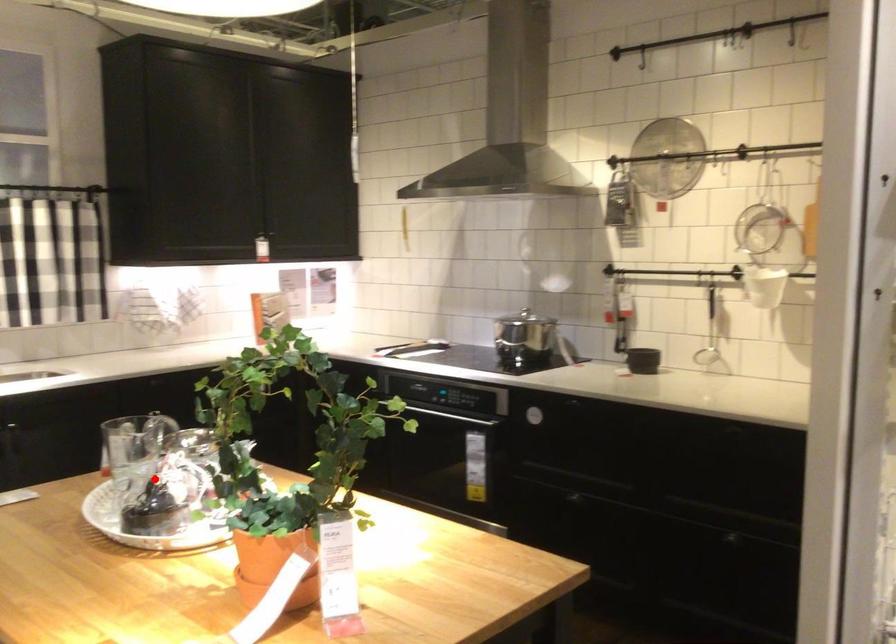
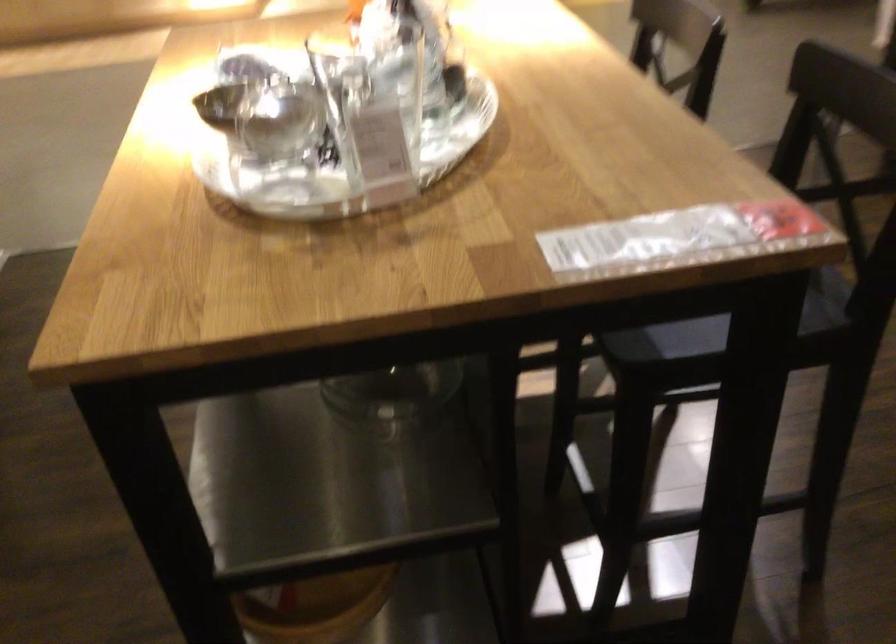
The point at the highlighted location is marked in the first image. Where is the corresponding point in the second image?

(371, 29)